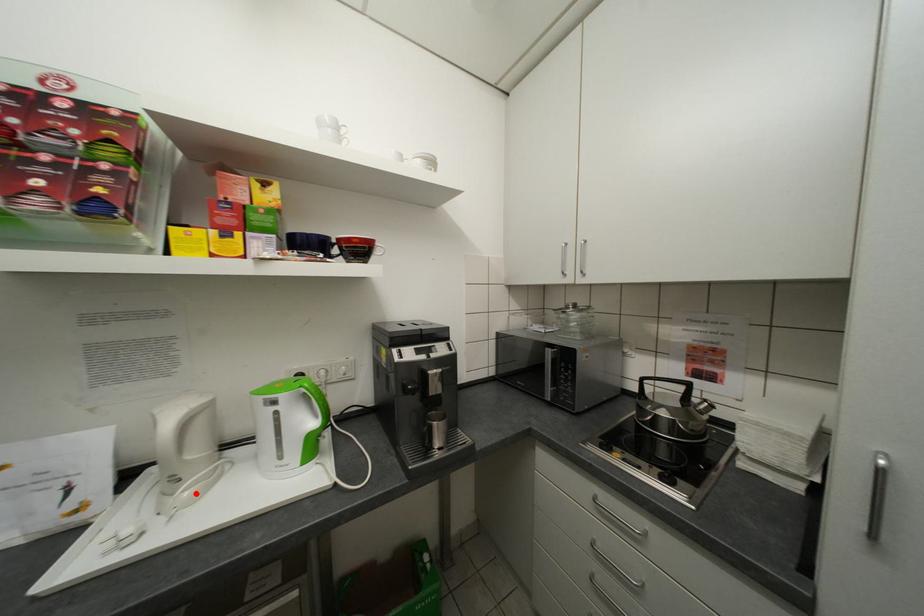
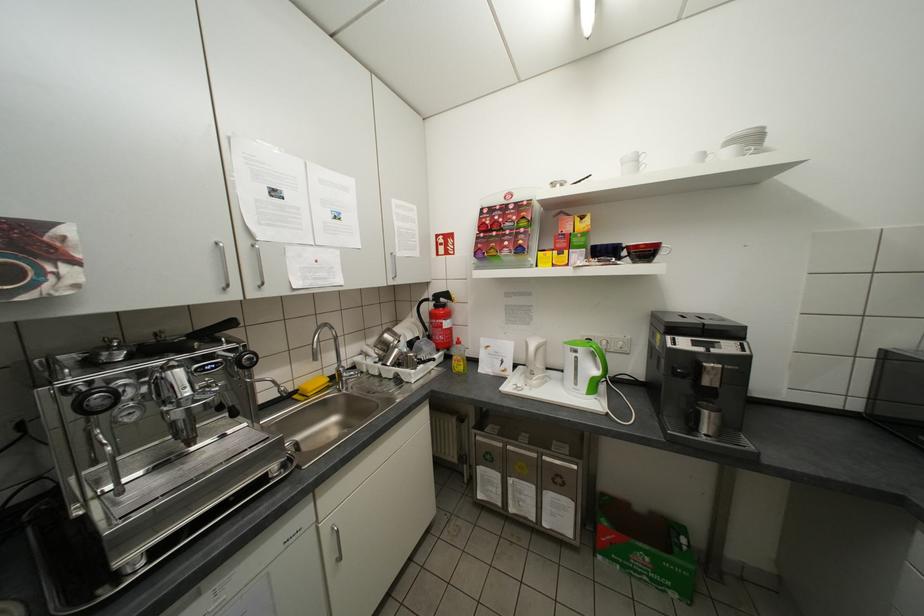
In the second image, find the point that corresponds to the highlighted location in the first image.

(543, 382)